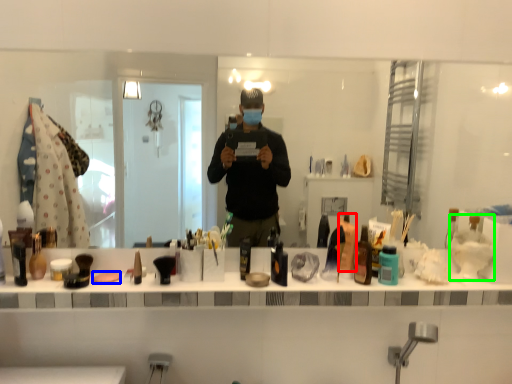
Question: Which object is the closest to the toiletry (highlighted by a red box)? Choose among these: soap (highlighted by a blue box) or shaving cream (highlighted by a green box).

Choices:
 (A) soap
 (B) shaving cream

Answer: (B)